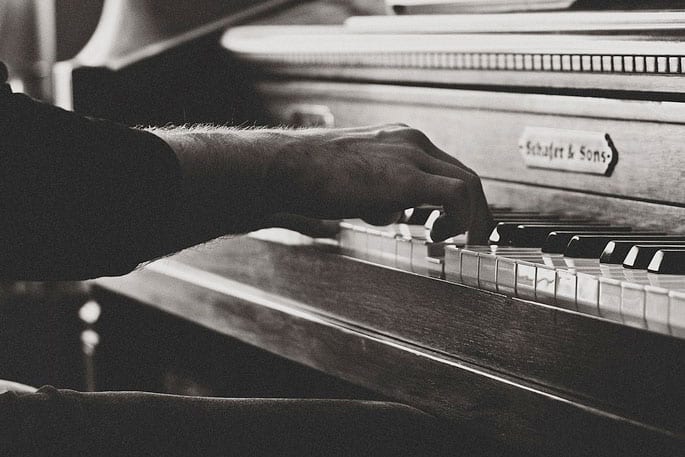
Locate an element on the screen. The height and width of the screenshot is (457, 685). texture of wood is located at coordinates [x=390, y=314], [x=408, y=309], [x=371, y=309].